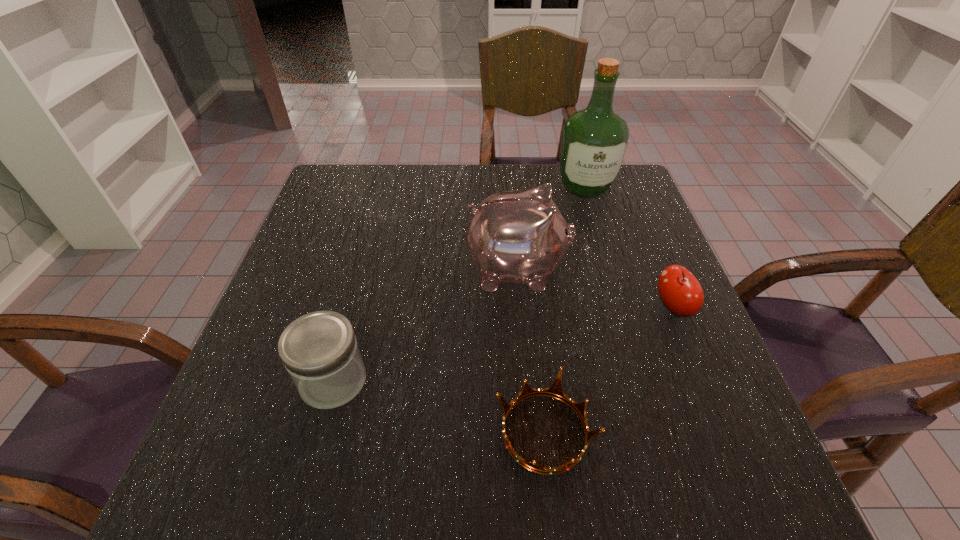
Where is `free space that satisfies the following two spatial constraints: 1. on the front side of the jar; 2. on the right side of the shortest object`? free space that satisfies the following two spatial constraints: 1. on the front side of the jar; 2. on the right side of the shortest object is located at coordinates (320, 432).

Where is `blank area in the image that satisfies the following two spatial constraints: 1. on the front-facing side of the apple; 2. on the right side of the tallest object`? The width and height of the screenshot is (960, 540). blank area in the image that satisfies the following two spatial constraints: 1. on the front-facing side of the apple; 2. on the right side of the tallest object is located at coordinates (621, 308).

Image resolution: width=960 pixels, height=540 pixels. In order to click on free location that satisfies the following two spatial constraints: 1. on the front-facing side of the tallest object; 2. on the right side of the fourth tallest object in this screenshot , I will do `click(621, 308)`.

The image size is (960, 540). Identify the location of vacant space that satisfies the following two spatial constraints: 1. on the front side of the leftmost object; 2. on the left side of the shortest object. (320, 432).